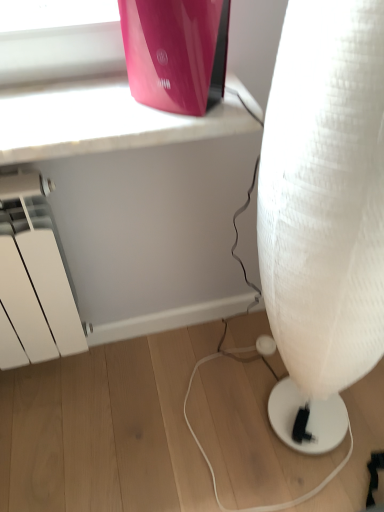
Question: In the image, is glossy plastic router at upper center positioned in front of or behind white fabric lamp at lower right?

Choices:
 (A) behind
 (B) front

Answer: (A)

Question: From a real-world perspective, is glossy plastic router at upper center positioned above or below white fabric lamp at lower right?

Choices:
 (A) above
 (B) below

Answer: (A)

Question: From their relative heights in the image, would you say glossy plastic router at upper center is taller or shorter than white fabric lamp at lower right?

Choices:
 (A) short
 (B) tall

Answer: (A)

Question: Is point (377, 292) positioned closer to the camera than point (195, 55)?

Choices:
 (A) closer
 (B) farther

Answer: (A)

Question: Is white fabric lamp at lower right situated inside glossy plastic router at upper center or outside?

Choices:
 (A) inside
 (B) outside

Answer: (B)

Question: From a real-world perspective, is white fabric lamp at lower right positioned above or below glossy plastic router at upper center?

Choices:
 (A) above
 (B) below

Answer: (B)

Question: Considering the positions of white fabric lamp at lower right and glossy plastic router at upper center in the image, is white fabric lamp at lower right taller or shorter than glossy plastic router at upper center?

Choices:
 (A) short
 (B) tall

Answer: (B)